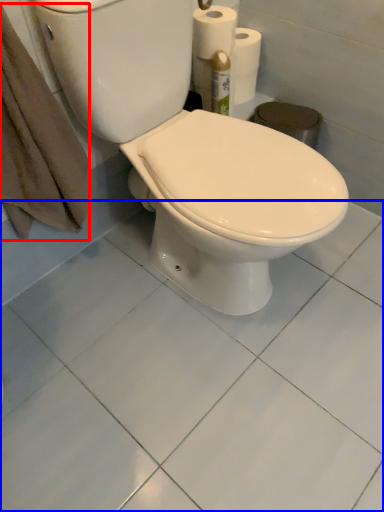
Question: Which point is further to the camera, bath towel (highlighted by a red box) or ceramic tile (highlighted by a blue box)?

Choices:
 (A) bath towel
 (B) ceramic tile

Answer: (B)